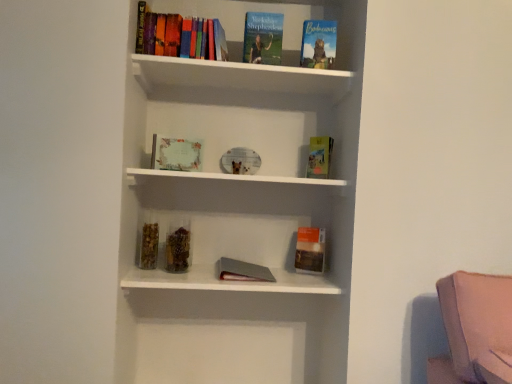
Describe the element at coordinates (179, 36) in the screenshot. This screenshot has width=512, height=384. I see `hardcover book at upper center, which is the third book from right to left` at that location.

What do you see at coordinates (310, 250) in the screenshot? The width and height of the screenshot is (512, 384). I see `matte orange paperback book at right, the 1th paperback book when ordered from bottom to top` at bounding box center [310, 250].

What is the approximate height of hardcover book at upper center, the 2th book viewed from the right?

It is 25.31 centimeters.

The height and width of the screenshot is (384, 512). Identify the location of hardcover book at center, which ranks as the 2th paperback book in bottom-to-top order. (319, 157).

What do you see at coordinates (319, 157) in the screenshot? Image resolution: width=512 pixels, height=384 pixels. I see `hardcover book at center, marked as the first paperback book in a top-to-bottom arrangement` at bounding box center [319, 157].

What are the coordinates of `hardcover book at upper center, marked as the 2th book in a left-to-right arrangement` in the screenshot? It's located at (179, 36).

In terms of height, does hardcover book at upper right, placed as the 1th book when sorted from right to left, look taller or shorter compared to hardcover book at upper center, marked as the 2th book in a left-to-right arrangement?

Clearly, hardcover book at upper right, placed as the 1th book when sorted from right to left, is shorter compared to hardcover book at upper center, marked as the 2th book in a left-to-right arrangement.

Is hardcover book at upper center, marked as the 2th book in a left-to-right arrangement, surrounded by hardcover book at upper right, placed as the 1th book when sorted from right to left?

Definitely not — hardcover book at upper center, marked as the 2th book in a left-to-right arrangement, is not inside hardcover book at upper right, placed as the 1th book when sorted from right to left.

Is hardcover book at upper right, positioned as the 4th book in left-to-right order, facing away from hardcover book at upper center, marked as the 2th book in a left-to-right arrangement?

That's not correct — hardcover book at upper right, positioned as the 4th book in left-to-right order, is not looking away from hardcover book at upper center, marked as the 2th book in a left-to-right arrangement.

Can you confirm if hardcover book at upper right, placed as the 1th book when sorted from right to left, is thinner than hardcover book at upper center, marked as the 2th book in a left-to-right arrangement?

Indeed, hardcover book at upper right, placed as the 1th book when sorted from right to left, has a lesser width compared to hardcover book at upper center, marked as the 2th book in a left-to-right arrangement.

Could matte orange paperback book at right, acting as the second paperback book starting from the top, be considered to be inside hardcover book at center, marked as the first paperback book in a top-to-bottom arrangement?

Definitely not — matte orange paperback book at right, acting as the second paperback book starting from the top, is not inside hardcover book at center, marked as the first paperback book in a top-to-bottom arrangement.

Are hardcover book at center, which ranks as the 2th paperback book in bottom-to-top order, and matte orange paperback book at right, acting as the second paperback book starting from the top, making contact?

No, hardcover book at center, which ranks as the 2th paperback book in bottom-to-top order, is not with matte orange paperback book at right, acting as the second paperback book starting from the top.

Is point (325, 177) closer or farther from the camera than point (296, 269)?

Clearly, point (325, 177) is more distant from the camera than point (296, 269).

Considering the sizes of hardcover book at upper center, the third book from the left, and matte paper certificate at center, marked as the 1th book in a left-to-right arrangement, in the image, is hardcover book at upper center, the third book from the left, wider or thinner than matte paper certificate at center, marked as the 1th book in a left-to-right arrangement,?

In the image, hardcover book at upper center, the third book from the left, appears to be wider than matte paper certificate at center, marked as the 1th book in a left-to-right arrangement.

Which point is more distant from viewer, (278, 54) or (182, 152)?

Point (182, 152)

From a real-world perspective, is hardcover book at upper center, the third book from the left, physically below matte paper certificate at center, marked as the 1th book in a left-to-right arrangement?

Actually, hardcover book at upper center, the third book from the left, is physically above matte paper certificate at center, marked as the 1th book in a left-to-right arrangement, in the real world.

How different are the orientations of hardcover book at upper center, the 2th book viewed from the right, and matte paper certificate at center, marked as the 1th book in a left-to-right arrangement, in degrees?

25.3 degrees.

From a real-world perspective, which object stands above the other?

In real-world perspective, hardcover book at center, marked as the first paperback book in a top-to-bottom arrangement, is above.

Would you say hardcover book at center, which ranks as the 2th paperback book in bottom-to-top order, is part of matte paper certificate at center, marked as the 1th book in a left-to-right arrangement,'s contents?

No, hardcover book at center, which ranks as the 2th paperback book in bottom-to-top order, is not surrounded by matte paper certificate at center, marked as the 1th book in a left-to-right arrangement.

Which point is more distant from viewer, (169, 157) or (326, 173)?

The point (326, 173) is farther from the camera.

Looking at this image, how many degrees apart are the facing directions of matte paper certificate at center, arranged as the 4th book when viewed from the right, and hardcover book at center, which ranks as the 2th paperback book in bottom-to-top order?

They differ by 56.3 degrees in their facing directions.

From the image's perspective, is hardcover book at center, which ranks as the 2th paperback book in bottom-to-top order, beneath hardcover book at upper right, positioned as the 4th book in left-to-right order?

Correct, hardcover book at center, which ranks as the 2th paperback book in bottom-to-top order, appears lower than hardcover book at upper right, positioned as the 4th book in left-to-right order, in the image.

Can you confirm if hardcover book at center, which ranks as the 2th paperback book in bottom-to-top order, is smaller than hardcover book at upper right, placed as the 1th book when sorted from right to left?

Yes.

Is point (328, 170) farther from viewer compared to point (331, 45)?

Yes.

Which of these two, hardcover book at center, which ranks as the 2th paperback book in bottom-to-top order, or matte paper certificate at center, marked as the 1th book in a left-to-right arrangement, stands shorter?

With less height is matte paper certificate at center, marked as the 1th book in a left-to-right arrangement.

How many degrees apart are the facing directions of hardcover book at center, which ranks as the 2th paperback book in bottom-to-top order, and matte paper certificate at center, marked as the 1th book in a left-to-right arrangement?

There is a 56.3-degree angle between the facing directions of hardcover book at center, which ranks as the 2th paperback book in bottom-to-top order, and matte paper certificate at center, marked as the 1th book in a left-to-right arrangement.

Can we say hardcover book at center, marked as the first paperback book in a top-to-bottom arrangement, lies outside matte paper certificate at center, marked as the 1th book in a left-to-right arrangement?

Yes, hardcover book at center, marked as the first paperback book in a top-to-bottom arrangement, is located beyond the bounds of matte paper certificate at center, marked as the 1th book in a left-to-right arrangement.

Which point is more distant from viewer, (327, 139) or (178, 165)?

The point (327, 139) is behind.

Looking at this image, is matte paper certificate at center, marked as the 1th book in a left-to-right arrangement, touching hardcover book at upper center, the third book from the left?

matte paper certificate at center, marked as the 1th book in a left-to-right arrangement, is not next to hardcover book at upper center, the third book from the left, and they're not touching.

The width and height of the screenshot is (512, 384). I want to click on the 2nd book directly beneath the hardcover book at upper center, the 2th book viewed from the right (from a real-world perspective), so point(176,154).

Does point (152, 153) come in front of point (248, 46)?

No, it is behind (248, 46).

The height and width of the screenshot is (384, 512). What are the coordinates of `the 2nd book in front of the hardcover book at upper right, placed as the 1th book when sorted from right to left, starting your count from the anchor` in the screenshot? It's located at (179, 36).

This screenshot has height=384, width=512. In order to click on paperback book above the matte orange paperback book at right, the 1th paperback book when ordered from bottom to top (from the image's perspective) in this screenshot , I will do `click(319, 157)`.

From the picture: Looking at the image, which one is located closer to matte orange paperback book at right, acting as the second paperback book starting from the top, hardcover book at center, marked as the first paperback book in a top-to-bottom arrangement, or hardcover book at upper right, placed as the 1th book when sorted from right to left?

hardcover book at center, marked as the first paperback book in a top-to-bottom arrangement.

Considering their positions, is hardcover book at center, which ranks as the 2th paperback book in bottom-to-top order, positioned closer to hardcover book at upper center, marked as the 2th book in a left-to-right arrangement, than hardcover book at upper center, the third book from the left?

Among the two, hardcover book at upper center, the third book from the left, is located nearer to hardcover book at upper center, marked as the 2th book in a left-to-right arrangement.

When comparing their distances from matte paper certificate at center, arranged as the 4th book when viewed from the right, does hardcover book at upper right, placed as the 1th book when sorted from right to left, or matte orange paperback book at right, acting as the second paperback book starting from the top, seem closer?

Among the two, matte orange paperback book at right, acting as the second paperback book starting from the top, is located nearer to matte paper certificate at center, arranged as the 4th book when viewed from the right.

When comparing their distances from hardcover book at upper center, marked as the 2th book in a left-to-right arrangement, does matte orange paperback book at right, the 1th paperback book when ordered from bottom to top, or hardcover book at center, which ranks as the 2th paperback book in bottom-to-top order, seem further?

matte orange paperback book at right, the 1th paperback book when ordered from bottom to top.

Which object lies further to the anchor point matte paper certificate at center, marked as the 1th book in a left-to-right arrangement, hardcover book at upper center, the third book from the left, or hardcover book at upper center, which is the third book from right to left?

hardcover book at upper center, the third book from the left.

Considering their positions, is matte paper certificate at center, marked as the 1th book in a left-to-right arrangement, positioned closer to hardcover book at center, marked as the first paperback book in a top-to-bottom arrangement, than hardcover book at upper center, the third book from the left?

The object closer to hardcover book at center, marked as the first paperback book in a top-to-bottom arrangement, is hardcover book at upper center, the third book from the left.

Looking at the image, which one is located closer to matte paper certificate at center, arranged as the 4th book when viewed from the right, hardcover book at upper center, the 2th book viewed from the right, or hardcover book at center, marked as the first paperback book in a top-to-bottom arrangement?

hardcover book at upper center, the 2th book viewed from the right, lies closer to matte paper certificate at center, arranged as the 4th book when viewed from the right, than the other object.

Which object lies nearer to the anchor point matte orange paperback book at right, acting as the second paperback book starting from the top, matte paper certificate at center, marked as the 1th book in a left-to-right arrangement, or hardcover book at center, marked as the first paperback book in a top-to-bottom arrangement?

Based on the image, hardcover book at center, marked as the first paperback book in a top-to-bottom arrangement, appears to be nearer to matte orange paperback book at right, acting as the second paperback book starting from the top.

Locate an element on the screen. This screenshot has height=384, width=512. paperback book between hardcover book at upper center, the 2th book viewed from the right, and matte orange paperback book at right, the 1th paperback book when ordered from bottom to top, in the up-down direction is located at coordinates (319, 157).

The height and width of the screenshot is (384, 512). Identify the location of paperback book situated between matte paper certificate at center, arranged as the 4th book when viewed from the right, and hardcover book at center, which ranks as the 2th paperback book in bottom-to-top order, from left to right. (310, 250).

Where is `book situated between hardcover book at upper center, marked as the 2th book in a left-to-right arrangement, and hardcover book at upper right, positioned as the 4th book in left-to-right order, from left to right`? book situated between hardcover book at upper center, marked as the 2th book in a left-to-right arrangement, and hardcover book at upper right, positioned as the 4th book in left-to-right order, from left to right is located at coordinates (263, 38).

Identify the location of paperback book between hardcover book at upper center, marked as the 2th book in a left-to-right arrangement, and matte orange paperback book at right, the 1th paperback book when ordered from bottom to top, in the up-down direction. This screenshot has width=512, height=384. [319, 157].